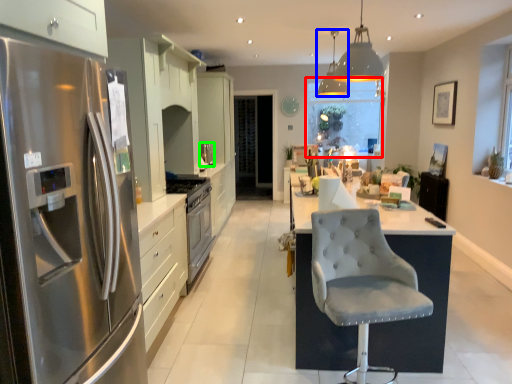
Question: Which is nearer to the window screen (highlighted by a red box)? light fixture (highlighted by a blue box) or appliance (highlighted by a green box).

Choices:
 (A) light fixture
 (B) appliance

Answer: (A)